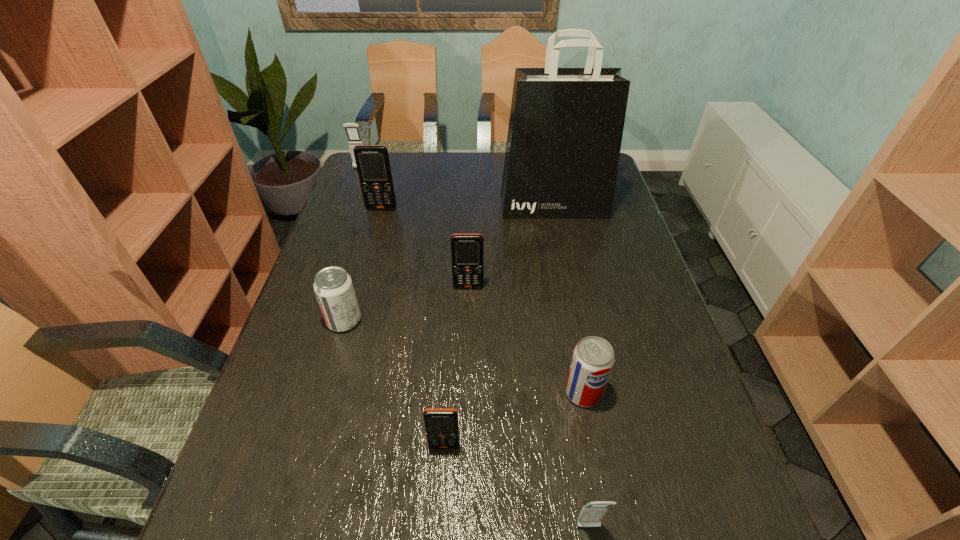
Find the location of a particular element. The width and height of the screenshot is (960, 540). cellular telephone that can be found as the fourth closest to the nearest orange cellular telephone is located at coordinates (352, 130).

Image resolution: width=960 pixels, height=540 pixels. What are the coordinates of `the third closest cellular telephone to the seventh shortest object` in the screenshot? It's located at (441, 424).

At what (x,y) coordinates should I click in order to perform the action: click on orange cellular telephone that stands as the closest to the fifth farthest object. Please return your answer as a coordinate pair (x, y). This screenshot has width=960, height=540. Looking at the image, I should click on (467, 250).

Select which orange cellular telephone appears as the second closest to the second nearest orange cellular telephone. Please provide its 2D coordinates. Your answer should be formatted as a tuple, i.e. [(x, y)], where the tuple contains the x and y coordinates of a point satisfying the conditions above.

[(441, 424)]

Where is `free point that satisfies the following two spatial constraints: 1. on the screen of the right soda can; 2. on the left side of the leftmost orange cellular telephone`? The image size is (960, 540). free point that satisfies the following two spatial constraints: 1. on the screen of the right soda can; 2. on the left side of the leftmost orange cellular telephone is located at coordinates (331, 393).